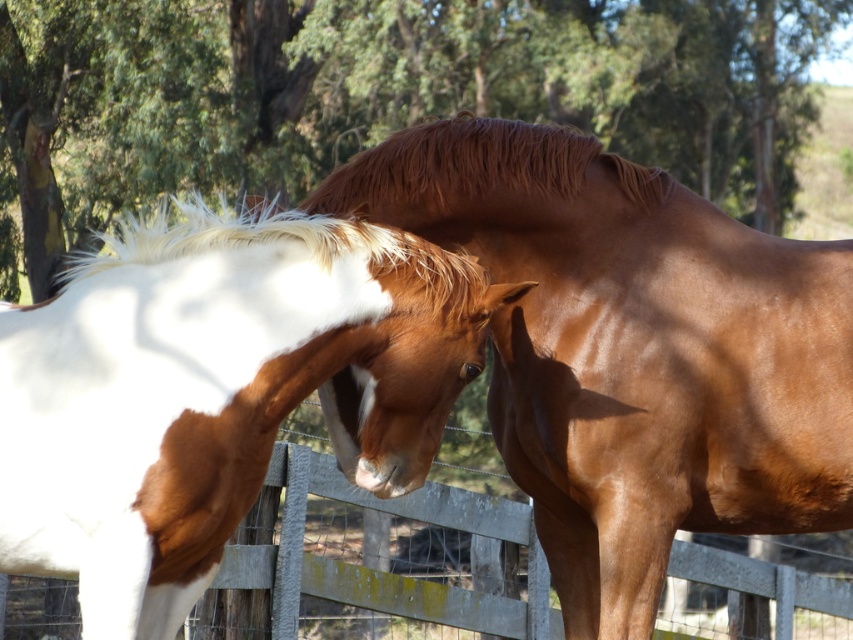
Is white glossy horse at left to the right of wooden fence at lower center from the viewer's perspective?

In fact, white glossy horse at left is to the left of wooden fence at lower center.

Consider the image. Can you confirm if white glossy horse at left is shorter than wooden fence at lower center?

No.

This screenshot has width=853, height=640. What do you see at coordinates (213, 390) in the screenshot? I see `white glossy horse at left` at bounding box center [213, 390].

Find the location of a particular element. This screenshot has width=853, height=640. white glossy horse at left is located at coordinates (213, 390).

How distant is shiny brown horse at center from wooden fence at lower center?

They are 5.64 feet apart.

Is point (570, 269) less distant than point (816, 584)?

Yes, it is in front of point (816, 584).

Locate an element on the screen. The width and height of the screenshot is (853, 640). shiny brown horse at center is located at coordinates (630, 349).

Who is more forward, (643, 602) or (84, 518)?

Positioned in front is point (84, 518).

At what (x,y) coordinates should I click in order to perform the action: click on shiny brown horse at center. Please return your answer as a coordinate pair (x, y). The image size is (853, 640). Looking at the image, I should click on (630, 349).